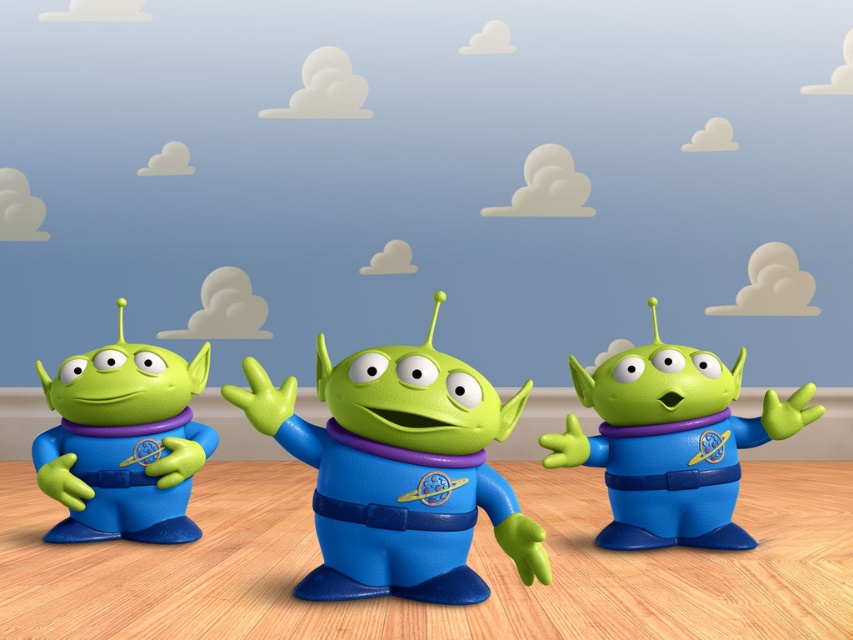
Question: Among these objects, which one is nearest to the camera?

Choices:
 (A) matte plastic alien at center
 (B) matte plastic alien at left
 (C) matte green alien at right

Answer: (A)

Question: Can you confirm if matte plastic alien at center is bigger than matte green alien at right?

Choices:
 (A) yes
 (B) no

Answer: (B)

Question: Is the position of matte plastic alien at center less distant than that of matte plastic alien at left?

Choices:
 (A) no
 (B) yes

Answer: (B)

Question: Is matte plastic alien at center closer to camera compared to matte green alien at right?

Choices:
 (A) no
 (B) yes

Answer: (B)

Question: Which object appears closest to the camera in this image?

Choices:
 (A) matte green alien at right
 (B) matte plastic alien at center
 (C) matte plastic alien at left

Answer: (B)

Question: Which is farther from the matte plastic alien at center?

Choices:
 (A) matte green alien at right
 (B) matte plastic alien at left

Answer: (B)